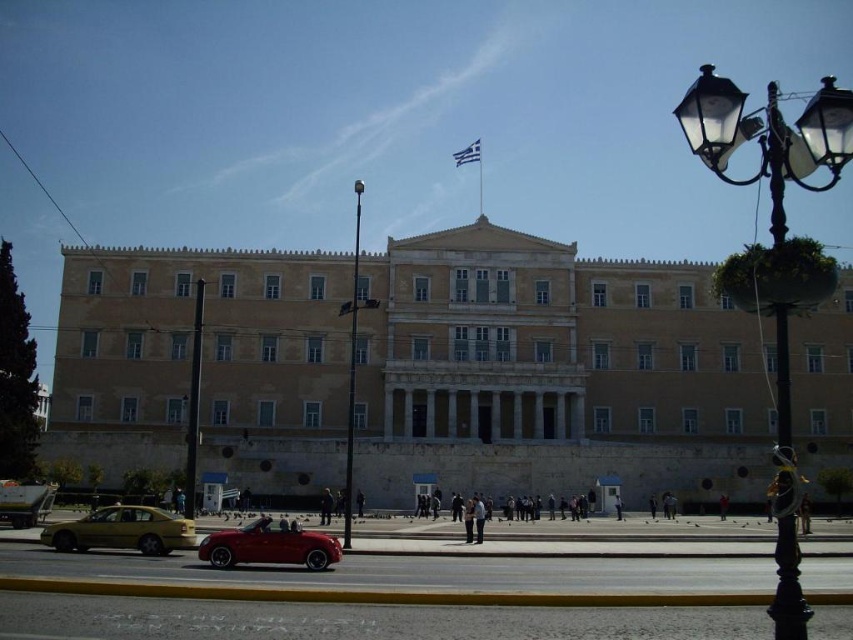
Is yellow matte sedan at lower left thinner than black glass pole at center?

In fact, yellow matte sedan at lower left might be wider than black glass pole at center.

Is point (53, 545) farther from viewer compared to point (350, 452)?

That is False.

Identify the location of yellow matte sedan at lower left. (122, 531).

Consider the image. Does beige stone building at center have a greater width compared to black glass streetlight at right?

Yes, beige stone building at center is wider than black glass streetlight at right.

Which of these two, beige stone building at center or black glass streetlight at right, stands taller?

black glass streetlight at right is taller.

The image size is (853, 640). Find the location of `beige stone building at center`. beige stone building at center is located at coordinates (552, 346).

Is yellow matte sedan at lower left closer to camera compared to shiny red convertible at center?

No, yellow matte sedan at lower left is further to the viewer.

Does yellow matte sedan at lower left lie behind shiny red convertible at center?

Yes, it is.

Between point (86, 548) and point (297, 544), which one is positioned in front?

Positioned in front is point (297, 544).

Where is `yellow matte sedan at lower left`? yellow matte sedan at lower left is located at coordinates (122, 531).